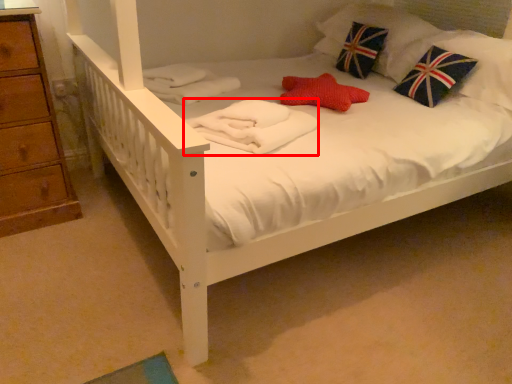
Question: Observing the image, what is the correct spatial positioning of material (annotated by the red box) in reference to pillow?

Choices:
 (A) left
 (B) right

Answer: (A)